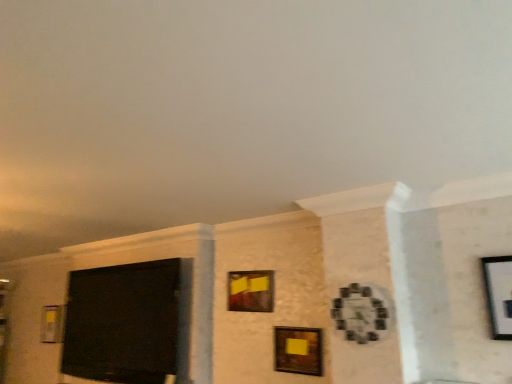
This screenshot has width=512, height=384. In order to click on matte black picture frame at left, which is the first picture frame in back-to-front order in this screenshot , I will do `click(52, 323)`.

At what (x,y) coordinates should I click in order to perform the action: click on wooden clock at center-right, arranged as the 4th picture frame when viewed from the back. Please return your answer as a coordinate pair (x, y). This screenshot has height=384, width=512. Looking at the image, I should click on (359, 313).

From a real-world perspective, which object rests below the other?

In real-world perspective, matte black screen at left is lower.

In terms of size, does matte black screen at left appear bigger or smaller than wooden clock at center-right, the first picture frame viewed from the right?

Considering their sizes, matte black screen at left takes up more space than wooden clock at center-right, the first picture frame viewed from the right.

Is matte black screen at left far away from wooden clock at center-right, the first picture frame viewed from the right?

That's right, there is a large distance between matte black screen at left and wooden clock at center-right, the first picture frame viewed from the right.

Between matte black picture frame at left, positioned as the first picture frame in left-to-right order, and wooden clock at center-right, the first picture frame viewed from the right, which one has less height?

wooden clock at center-right, the first picture frame viewed from the right.

Could you tell me if matte black picture frame at left, which ranks as the 4th picture frame in front-to-back order, is facing wooden clock at center-right, arranged as the 4th picture frame when viewed from the back?

No, matte black picture frame at left, which ranks as the 4th picture frame in front-to-back order, is not oriented towards wooden clock at center-right, arranged as the 4th picture frame when viewed from the back.

Considering the positions of points (51, 307) and (376, 319), is point (51, 307) closer to camera compared to point (376, 319)?

That is False.

Is matte black picture frame at left, positioned as the first picture frame in left-to-right order, in front of or behind matte wooden picture frame at center, which is the second picture frame in front-to-back order, in the image?

matte black picture frame at left, positioned as the first picture frame in left-to-right order, is behind matte wooden picture frame at center, which is the second picture frame in front-to-back order.

Does matte black picture frame at left, which is the first picture frame in back-to-front order, have a lesser width compared to matte wooden picture frame at center, the 2th picture frame viewed from the right?

Incorrect, the width of matte black picture frame at left, which is the first picture frame in back-to-front order, is not less than that of matte wooden picture frame at center, the 2th picture frame viewed from the right.

Between matte black picture frame at left, which is the fourth picture frame from right to left, and matte wooden picture frame at center, which appears as the third picture frame when viewed from the left, which one has more height?

With more height is matte black picture frame at left, which is the fourth picture frame from right to left.

Considering the positions of points (54, 320) and (305, 369), is point (54, 320) farther from camera compared to point (305, 369)?

Yes.

How different are the orientations of matte black screen at left and matte black picture frame at left, which ranks as the 4th picture frame in front-to-back order, in degrees?

The angular difference between matte black screen at left and matte black picture frame at left, which ranks as the 4th picture frame in front-to-back order, is 0.686 degrees.

Who is shorter, matte black screen at left or matte black picture frame at left, positioned as the first picture frame in left-to-right order?

With less height is matte black picture frame at left, positioned as the first picture frame in left-to-right order.

Considering the sizes of matte black screen at left and matte black picture frame at left, which ranks as the 4th picture frame in front-to-back order, in the image, is matte black screen at left wider or thinner than matte black picture frame at left, which ranks as the 4th picture frame in front-to-back order,?

In the image, matte black screen at left appears to be wider than matte black picture frame at left, which ranks as the 4th picture frame in front-to-back order.

Is matte black picture frame at left, which is the first picture frame in back-to-front order, a part of matte black screen at left?

That's incorrect, matte black picture frame at left, which is the first picture frame in back-to-front order, is not inside matte black screen at left.

From a real-world perspective, which object rests below the other?

matte black screen at left, from a real-world perspective.

In the image, there is a matte yellow paper at center, which ranks as the third picture frame in front-to-back order. Identify the location of projection screen below it (from a real-world perspective). (126, 323).

Considering the positions of objects matte yellow paper at center, acting as the 2th picture frame starting from the back, and matte black screen at left in the image provided, who is in front, matte yellow paper at center, acting as the 2th picture frame starting from the back, or matte black screen at left?

matte yellow paper at center, acting as the 2th picture frame starting from the back.

In the scene shown: How far apart are matte yellow paper at center, which ranks as the third picture frame in front-to-back order, and matte black screen at left?

The distance of matte yellow paper at center, which ranks as the third picture frame in front-to-back order, from matte black screen at left is 28.80 inches.

Between wooden clock at center-right, which appears as the first picture frame when viewed from the front, and matte wooden picture frame at center, acting as the 3th picture frame starting from the back, which one has larger size?

Bigger between the two is wooden clock at center-right, which appears as the first picture frame when viewed from the front.

From a real-world perspective, between wooden clock at center-right, arranged as the 4th picture frame when viewed from the back, and matte wooden picture frame at center, the 2th picture frame viewed from the right, who is vertically higher?

wooden clock at center-right, arranged as the 4th picture frame when viewed from the back, from a real-world perspective.

Which point is more distant from viewer, [375,335] or [286,336]?

The point [286,336] is more distant.

Is wooden clock at center-right, arranged as the 4th picture frame when viewed from the back, at the right side of matte wooden picture frame at center, the 2th picture frame viewed from the right?

Yes.

Between matte black screen at left and matte yellow paper at center, which is the third picture frame in right-to-left order, which one is positioned behind?

Positioned behind is matte black screen at left.

Who is smaller, matte black screen at left or matte yellow paper at center, which is the third picture frame in right-to-left order?

Smaller between the two is matte yellow paper at center, which is the third picture frame in right-to-left order.

Is matte black screen at left positioned with its back to matte yellow paper at center, which is the third picture frame in right-to-left order?

No, matte yellow paper at center, which is the third picture frame in right-to-left order, is not at the back of matte black screen at left.

Does matte black screen at left have a greater height compared to matte yellow paper at center, which ranks as the third picture frame in front-to-back order?

Indeed, matte black screen at left has a greater height compared to matte yellow paper at center, which ranks as the third picture frame in front-to-back order.

Image resolution: width=512 pixels, height=384 pixels. I want to click on projection screen below the wooden clock at center-right, arranged as the 4th picture frame when viewed from the back (from a real-world perspective), so click(x=126, y=323).

From a real-world perspective, which picture frame is the 1st one above the matte black picture frame at left, positioned as the first picture frame in left-to-right order? Please provide its 2D coordinates.

[(359, 313)]

Which object lies further to the anchor point matte black picture frame at left, which is the first picture frame in back-to-front order, matte wooden picture frame at center, which appears as the third picture frame when viewed from the left, or matte yellow paper at center, acting as the 2th picture frame starting from the back?

Among the two, matte wooden picture frame at center, which appears as the third picture frame when viewed from the left, is located further to matte black picture frame at left, which is the first picture frame in back-to-front order.

Estimate the real-world distances between objects in this image. Which object is further from wooden clock at center-right, marked as the fourth picture frame in a left-to-right arrangement, matte black picture frame at left, which is the fourth picture frame from right to left, or matte wooden picture frame at center, acting as the 3th picture frame starting from the back?

matte black picture frame at left, which is the fourth picture frame from right to left, is further to wooden clock at center-right, marked as the fourth picture frame in a left-to-right arrangement.

Which object lies further to the anchor point matte yellow paper at center, which is the third picture frame in right-to-left order, matte black picture frame at left, which is the fourth picture frame from right to left, or matte black screen at left?

matte black picture frame at left, which is the fourth picture frame from right to left, lies further to matte yellow paper at center, which is the third picture frame in right-to-left order, than the other object.

Based on their spatial positions, is matte yellow paper at center, which is the third picture frame in right-to-left order, or matte black picture frame at left, which is the fourth picture frame from right to left, closer to matte black screen at left?

matte yellow paper at center, which is the third picture frame in right-to-left order.

Looking at the image, which one is located further to wooden clock at center-right, arranged as the 4th picture frame when viewed from the back, matte yellow paper at center, which ranks as the third picture frame in front-to-back order, or matte black screen at left?

matte black screen at left lies further to wooden clock at center-right, arranged as the 4th picture frame when viewed from the back, than the other object.

Estimate the real-world distances between objects in this image. Which object is further from matte black picture frame at left, which is the first picture frame in back-to-front order, wooden clock at center-right, marked as the fourth picture frame in a left-to-right arrangement, or matte yellow paper at center, acting as the 2th picture frame starting from the back?

Among the two, wooden clock at center-right, marked as the fourth picture frame in a left-to-right arrangement, is located further to matte black picture frame at left, which is the first picture frame in back-to-front order.

Estimate the real-world distances between objects in this image. Which object is further from matte yellow paper at center, the 2th picture frame positioned from the left, matte black picture frame at left, positioned as the first picture frame in left-to-right order, or matte wooden picture frame at center, which is the second picture frame in front-to-back order?

Based on the image, matte black picture frame at left, positioned as the first picture frame in left-to-right order, appears to be further to matte yellow paper at center, the 2th picture frame positioned from the left.

From the picture: Looking at the image, which one is located closer to matte wooden picture frame at center, which is the second picture frame in front-to-back order, matte yellow paper at center, which is the third picture frame in right-to-left order, or matte black screen at left?

matte yellow paper at center, which is the third picture frame in right-to-left order, lies closer to matte wooden picture frame at center, which is the second picture frame in front-to-back order, than the other object.

Image resolution: width=512 pixels, height=384 pixels. Identify the location of projection screen between matte black picture frame at left, which is the fourth picture frame from right to left, and matte yellow paper at center, the 2th picture frame positioned from the left. (x=126, y=323).

The image size is (512, 384). Find the location of `projection screen between matte black picture frame at left, which ranks as the 4th picture frame in front-to-back order, and wooden clock at center-right, the first picture frame viewed from the right`. projection screen between matte black picture frame at left, which ranks as the 4th picture frame in front-to-back order, and wooden clock at center-right, the first picture frame viewed from the right is located at coordinates (126, 323).

The height and width of the screenshot is (384, 512). What are the coordinates of `projection screen between matte black picture frame at left, which ranks as the 4th picture frame in front-to-back order, and matte wooden picture frame at center, acting as the 3th picture frame starting from the back, from left to right` in the screenshot? It's located at (126, 323).

This screenshot has width=512, height=384. What are the coordinates of `picture frame between matte black screen at left and matte wooden picture frame at center, which is the second picture frame in front-to-back order` in the screenshot? It's located at (251, 291).